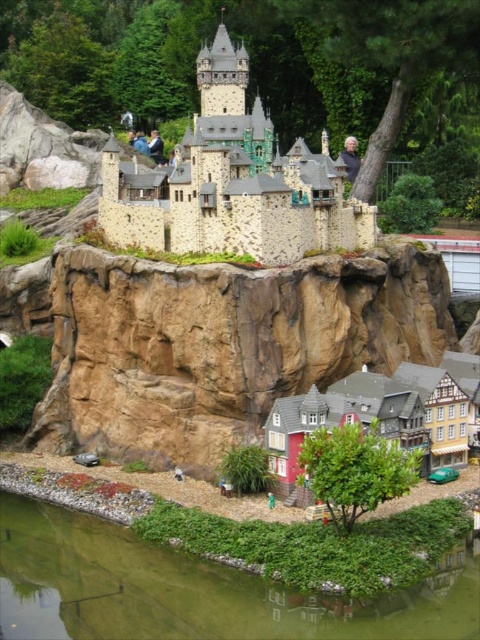
Is point (22, 499) closer to camera compared to point (197, 72)?

Yes.

Between green liquid water at lower center and stone brick castle at upper center, which one is positioned lower?

→ green liquid water at lower center is below.

Image resolution: width=480 pixels, height=640 pixels. In order to click on green liquid water at lower center in this screenshot , I will do `click(192, 589)`.

Is brown rock cliff at lower center smaller than stone brick castle at upper center?

Actually, brown rock cliff at lower center might be larger than stone brick castle at upper center.

Between brown rock cliff at lower center and stone brick castle at upper center, which one appears on the right side from the viewer's perspective?

From the viewer's perspective, brown rock cliff at lower center appears more on the right side.

Is point (315, 380) positioned before point (364, 244)?

Yes.

Where is `brown rock cliff at lower center`? The height and width of the screenshot is (640, 480). brown rock cliff at lower center is located at coordinates (220, 344).

Between point (55, 264) and point (252, 600), which one is positioned behind?

Point (55, 264)

Is brown rock cliff at lower center wider than green liquid water at lower center?

Yes, brown rock cliff at lower center is wider than green liquid water at lower center.

What do you see at coordinates (220, 344) in the screenshot? I see `brown rock cliff at lower center` at bounding box center [220, 344].

Where is `brown rock cliff at lower center`? Image resolution: width=480 pixels, height=640 pixels. brown rock cliff at lower center is located at coordinates (220, 344).